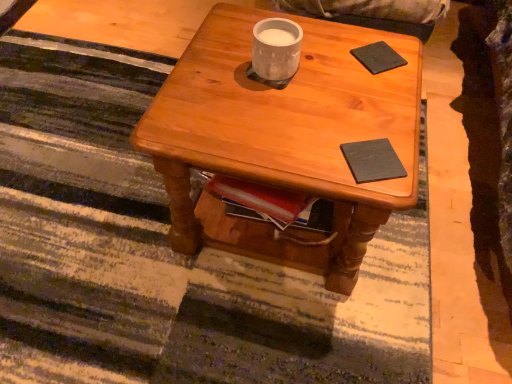
Locate an element on the screen. free space in front of black matte pad at upper right, the first pad viewed from the back is located at coordinates (373, 98).